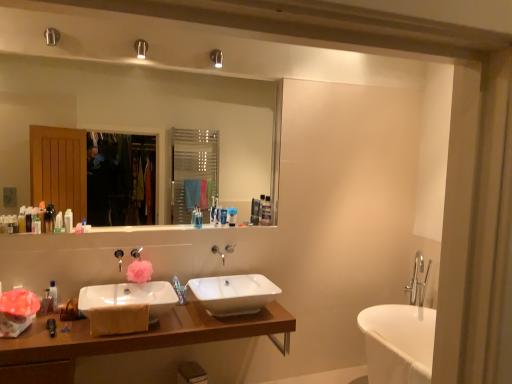
How much space does white glossy bottle at left, which is the sixth toiletry in right-to-left order, occupy vertically?

The height of white glossy bottle at left, which is the sixth toiletry in right-to-left order, is 13.83 centimeters.

Where is `clear plastic bottle at upper center, which appears as the 11th toiletry when viewed from the left`? This screenshot has height=384, width=512. clear plastic bottle at upper center, which appears as the 11th toiletry when viewed from the left is located at coordinates [255, 211].

Find the location of a particular element. The height and width of the screenshot is (384, 512). translucent plastic bottle at left, which appears as the 12th toiletry when viewed from the right is located at coordinates (22, 220).

The height and width of the screenshot is (384, 512). What are the coordinates of `translucent plastic bottle at lower left, arranged as the 7th toiletry when viewed from the right` in the screenshot? It's located at (54, 294).

The image size is (512, 384). Describe the element at coordinates (265, 211) in the screenshot. I see `translucent plastic container at upper center, positioned as the 1th toiletry in right-to-left order` at that location.

Identify the location of white glossy bottle at left, the seventh toiletry positioned from the left. The height and width of the screenshot is (384, 512). (68, 221).

Which of these two, translucent plastic bottle at left, which is counted as the fifth toiletry, starting from the left, or matte black bottle at left, the 11th toiletry from the right, stands shorter?

With less height is matte black bottle at left, the 11th toiletry from the right.

Which object is further away from the camera taking this photo, translucent plastic bottle at left, which ranks as the eighth toiletry in right-to-left order, or matte black bottle at left, the 11th toiletry from the right?

translucent plastic bottle at left, which ranks as the eighth toiletry in right-to-left order, is behind.

Would you say translucent plastic bottle at left, which ranks as the eighth toiletry in right-to-left order, is a long distance from matte black bottle at left, placed as the second toiletry when sorted from left to right?

Actually, translucent plastic bottle at left, which ranks as the eighth toiletry in right-to-left order, and matte black bottle at left, placed as the second toiletry when sorted from left to right, are a little close together.

This screenshot has width=512, height=384. I want to click on the 2nd toiletry below the translucent plastic bottle at left, which is counted as the fifth toiletry, starting from the left (from a real-world perspective), so click(x=28, y=219).

Does point (23, 213) come in front of point (259, 205)?

Yes, point (23, 213) is closer to viewer.

Is the depth of translucent plastic bottle at left, which appears as the 12th toiletry when viewed from the right, less than that of clear plastic bottle at upper center, which ranks as the second toiletry in right-to-left order?

Yes, translucent plastic bottle at left, which appears as the 12th toiletry when viewed from the right, is closer to the camera.

Between translucent plastic bottle at left, which appears as the 12th toiletry when viewed from the right, and clear plastic bottle at upper center, which appears as the 11th toiletry when viewed from the left, which one has smaller size?

Smaller between the two is translucent plastic bottle at left, which appears as the 12th toiletry when viewed from the right.

Could clear plastic bottle at upper center, which appears as the 11th toiletry when viewed from the left, be considered to be inside translucent plastic bottle at left, placed as the 1th toiletry when sorted from left to right?

Definitely not — clear plastic bottle at upper center, which appears as the 11th toiletry when viewed from the left, is not inside translucent plastic bottle at left, placed as the 1th toiletry when sorted from left to right.

Is translucent plastic toothbrushes at center, the fifth toiletry when ordered from right to left, to the right of matte black bottle at left, placed as the second toiletry when sorted from left to right, from the viewer's perspective?

Yes.

Considering the sizes of objects translucent plastic toothbrushes at center, the fifth toiletry when ordered from right to left, and matte black bottle at left, placed as the second toiletry when sorted from left to right, in the image provided, who is shorter, translucent plastic toothbrushes at center, the fifth toiletry when ordered from right to left, or matte black bottle at left, placed as the second toiletry when sorted from left to right,?

Standing shorter between the two is matte black bottle at left, placed as the second toiletry when sorted from left to right.

From a real-world perspective, is translucent plastic toothbrushes at center, the fifth toiletry when ordered from right to left, positioned above or below matte black bottle at left, the 11th toiletry from the right?

In terms of real-world spatial position, translucent plastic toothbrushes at center, the fifth toiletry when ordered from right to left, is above matte black bottle at left, the 11th toiletry from the right.

Between point (200, 215) and point (28, 221), which one is positioned in front?

The point (28, 221) is in front.

How far apart are translucent plastic bottle at left, which is counted as the fifth toiletry, starting from the left, and translucent plastic toothbrushes at center, the fifth toiletry when ordered from right to left?

They are 36.58 inches apart.

How many degrees apart are the facing directions of translucent plastic bottle at left, which ranks as the eighth toiletry in right-to-left order, and translucent plastic toothbrushes at center, acting as the 8th toiletry starting from the left?

The angle between the facing direction of translucent plastic bottle at left, which ranks as the eighth toiletry in right-to-left order, and the facing direction of translucent plastic toothbrushes at center, acting as the 8th toiletry starting from the left, is 0.147 degrees.

You are a GUI agent. You are given a task and a screenshot of the screen. Output one action in this format:
    pyautogui.click(x=<x>, y=<y>)
    Task: Click on the toiletry that is the 1st one above the translucent plastic bottle at left, which is counted as the fifth toiletry, starting from the left (from a real-world perspective)
    
    Given the screenshot: What is the action you would take?
    pyautogui.click(x=197, y=217)

Which of these two, translucent plastic bottle at left, which ranks as the eighth toiletry in right-to-left order, or translucent plastic toothbrushes at center, the fifth toiletry when ordered from right to left, stands shorter?

With less height is translucent plastic bottle at left, which ranks as the eighth toiletry in right-to-left order.

Could you tell me if silver metallic tap at center is facing white glossy mirror at upper center?

No.

Which of these two, silver metallic tap at center or white glossy mirror at upper center, stands taller?

white glossy mirror at upper center.

Consider the image. Between silver metallic tap at center and white glossy mirror at upper center, which one has larger size?

white glossy mirror at upper center.

At what (x,y) coordinates should I click in order to perform the action: click on tap to the right of white glossy mirror at upper center. Please return your answer as a coordinate pair (x, y). Looking at the image, I should click on (218, 253).

Considering the sizes of objects translucent plastic bottles at left, which is the 9th toiletry in right-to-left order, and translucent plastic container at upper center, arranged as the 12th toiletry when viewed from the left, in the image provided, who is shorter, translucent plastic bottles at left, which is the 9th toiletry in right-to-left order, or translucent plastic container at upper center, arranged as the 12th toiletry when viewed from the left,?

translucent plastic bottles at left, which is the 9th toiletry in right-to-left order.

The height and width of the screenshot is (384, 512). Identify the location of the 2nd toiletry directly beneath the translucent plastic container at upper center, positioned as the 1th toiletry in right-to-left order (from a real-world perspective). (42, 215).

Consider the image. From the image's perspective, relative to translucent plastic container at upper center, positioned as the 1th toiletry in right-to-left order, is translucent plastic bottles at left, placed as the 4th toiletry when sorted from left to right, above or below?

translucent plastic bottles at left, placed as the 4th toiletry when sorted from left to right, is below translucent plastic container at upper center, positioned as the 1th toiletry in right-to-left order.

Considering the positions of objects translucent plastic bottles at left, which is the 9th toiletry in right-to-left order, and translucent plastic container at upper center, arranged as the 12th toiletry when viewed from the left, in the image provided, who is more to the left, translucent plastic bottles at left, which is the 9th toiletry in right-to-left order, or translucent plastic container at upper center, arranged as the 12th toiletry when viewed from the left,?

translucent plastic bottles at left, which is the 9th toiletry in right-to-left order, is more to the left.

At what (x,y) coordinates should I click in order to perform the action: click on the 10th toiletry behind the white glossy mirror at upper center. Please return your answer as a coordinate pair (x, y). Looking at the image, I should click on (232, 216).

Which is closer to the camera, (208, 119) or (232, 208)?

Point (208, 119) is positioned closer to the camera compared to point (232, 208).

Which of these two, white glossy mirror at upper center or satin silver toothbrush at center, the 10th toiletry from the left, is thinner?

satin silver toothbrush at center, the 10th toiletry from the left, is thinner.

Is white glossy mirror at upper center oriented towards satin silver toothbrush at center, the 3th toiletry when ordered from right to left?

Yes.

Where is `the 3rd toiletry above the matte black bottle at left, the 11th toiletry from the right (from the image's perspective)`? the 3rd toiletry above the matte black bottle at left, the 11th toiletry from the right (from the image's perspective) is located at coordinates (49, 218).

From the image's perspective, count 4th toiletrys downward from the clear plastic bottle at upper center, which ranks as the second toiletry in right-to-left order, and point to it. Please provide its 2D coordinates.

[(22, 220)]

When comparing their distances from translucent plastic bottle at left, marked as the 3th toiletry in a left-to-right arrangement, does translucent plastic container at upper center, arranged as the 12th toiletry when viewed from the left, or translucent plastic bottle at lower left, arranged as the 7th toiletry when viewed from the right, seem further?

Based on the image, translucent plastic container at upper center, arranged as the 12th toiletry when viewed from the left, appears to be further to translucent plastic bottle at left, marked as the 3th toiletry in a left-to-right arrangement.

Looking at the image, which one is located closer to white glossy bottle at left, the seventh toiletry positioned from the left, translucent plastic bottle at left, marked as the 3th toiletry in a left-to-right arrangement, or translucent plastic container at upper center, positioned as the 1th toiletry in right-to-left order?

The object closer to white glossy bottle at left, the seventh toiletry positioned from the left, is translucent plastic bottle at left, marked as the 3th toiletry in a left-to-right arrangement.

Based on their spatial positions, is wooden cabinet at lower left or translucent plastic toothbrushes at center, acting as the 8th toiletry starting from the left, further from translucent plastic bottle at lower left, the sixth toiletry from the left?

translucent plastic toothbrushes at center, acting as the 8th toiletry starting from the left, is further to translucent plastic bottle at lower left, the sixth toiletry from the left.

Estimate the real-world distances between objects in this image. Which object is closer to translucent plastic bottle at left, which appears as the 12th toiletry when viewed from the right, translucent plastic bottle at left, marked as the 3th toiletry in a left-to-right arrangement, or translucent plastic bottles at left, placed as the 4th toiletry when sorted from left to right?

The object closer to translucent plastic bottle at left, which appears as the 12th toiletry when viewed from the right, is translucent plastic bottle at left, marked as the 3th toiletry in a left-to-right arrangement.

Considering their positions, is blue matte toothpaste tube at center, which appears as the ninth toiletry when viewed from the left, positioned closer to wooden cabinet at lower left than translucent plastic toothbrushes at center, the fifth toiletry when ordered from right to left?

Among the two, translucent plastic toothbrushes at center, the fifth toiletry when ordered from right to left, is located nearer to wooden cabinet at lower left.

Considering their positions, is white glossy bottle at left, which is the sixth toiletry in right-to-left order, positioned closer to wooden cabinet at lower left than translucent plastic bottles at left, placed as the 4th toiletry when sorted from left to right?

white glossy bottle at left, which is the sixth toiletry in right-to-left order.

From the picture: Estimate the real-world distances between objects in this image. Which object is further from white ceramic sink at lower left, positioned as the first sink in left-to-right order, white glossy bottle at left, the seventh toiletry positioned from the left, or translucent plastic bottle at lower left, the sixth toiletry from the left?

Based on the image, white glossy bottle at left, the seventh toiletry positioned from the left, appears to be further to white ceramic sink at lower left, positioned as the first sink in left-to-right order.

When comparing their distances from silver metallic tap at center, does wooden cabinet at lower left or white ceramic sink at lower left, the 2th sink positioned from the right, seem closer?

The object closer to silver metallic tap at center is white ceramic sink at lower left, the 2th sink positioned from the right.

Image resolution: width=512 pixels, height=384 pixels. Identify the location of tap located between matte black bottle at left, placed as the second toiletry when sorted from left to right, and clear plastic bottle at upper center, which appears as the 11th toiletry when viewed from the left, in the left-right direction. (218, 253).

At what (x,y) coordinates should I click in order to perform the action: click on sink between translucent plastic bottle at left, marked as the 3th toiletry in a left-to-right arrangement, and satin silver toothbrush at center, the 3th toiletry when ordered from right to left, from left to right. Please return your answer as a coordinate pair (x, y). Looking at the image, I should click on (130, 296).

At what (x,y) coordinates should I click in order to perform the action: click on tap between white glossy bottle at left, which is the sixth toiletry in right-to-left order, and blue matte toothpaste tube at center, which appears as the ninth toiletry when viewed from the left. Please return your answer as a coordinate pair (x, y). This screenshot has height=384, width=512. Looking at the image, I should click on (218, 253).

Identify the location of sink located between matte black bottle at left, the 11th toiletry from the right, and satin silver toothbrush at center, the 3th toiletry when ordered from right to left, in the left-right direction. pos(130,296).